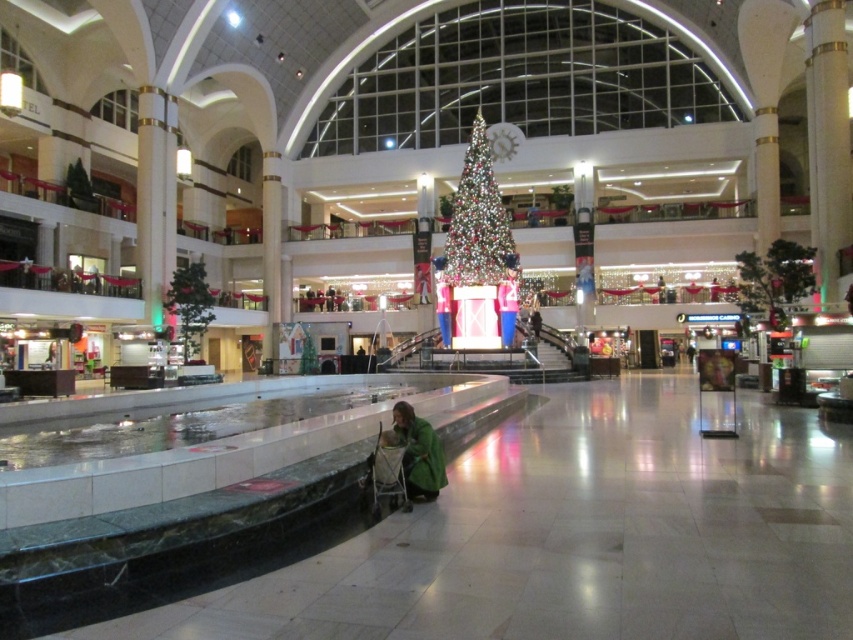
You are a window cleaner standing at the entrance of the mall. You need to clean the windows of the iridescent glass christmas tree at center and the green fabric at center. Which object will require you to use a taller ladder?

The iridescent glass christmas tree at center is taller than the green fabric at center, so you will need a taller ladder for the iridescent glass christmas tree at center.

You are a store manager checking the holiday decorations. You notice the iridescent glass christmas tree at center and the green fabric at center. Which one takes up more space in the mall?

The iridescent glass christmas tree at center is larger in size than the green fabric at center, so it takes up more space in the mall.